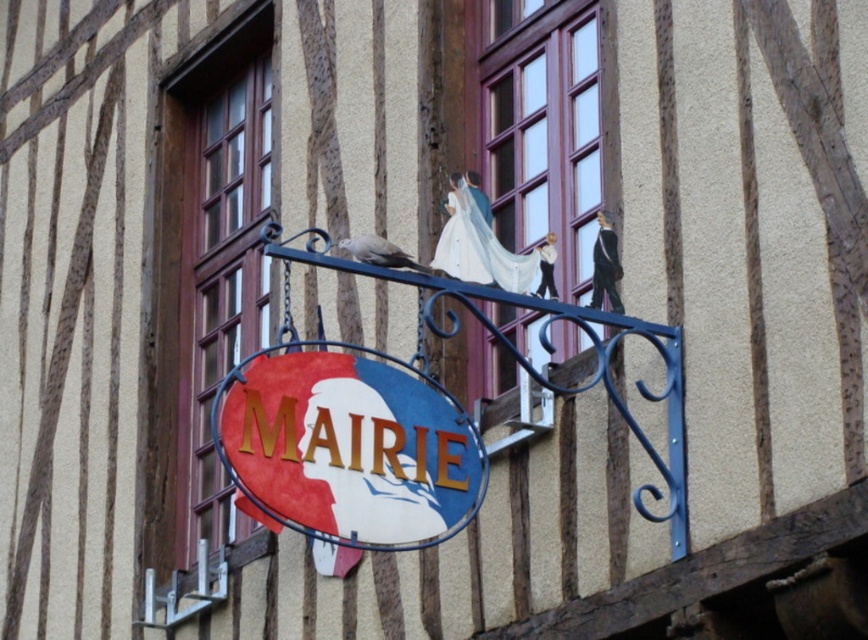
Question: Can you confirm if wooden window at left is smaller than gray matte pigeon at center?

Choices:
 (A) yes
 (B) no

Answer: (B)

Question: From the image, what is the correct spatial relationship of oval painted signboard at center in relation to wooden window frame at upper center?

Choices:
 (A) right
 (B) left

Answer: (B)

Question: Which of the following is the closest to the observer?

Choices:
 (A) 251,500
 (B) 372,253
 (C) 469,216

Answer: (A)

Question: Is wooden window frame at upper center positioned behind white satin dress at center?

Choices:
 (A) yes
 (B) no

Answer: (A)

Question: Estimate the real-world distances between objects in this image. Which object is farther from the white satin dress at center?

Choices:
 (A) wooden window frame at upper center
 (B) gray matte pigeon at center
 (C) oval painted signboard at center
 (D) wooden window at left

Answer: (D)

Question: Estimate the real-world distances between objects in this image. Which object is closer to the wooden window frame at upper center?

Choices:
 (A) white satin dress at center
 (B) wooden window at left
 (C) oval painted signboard at center

Answer: (A)